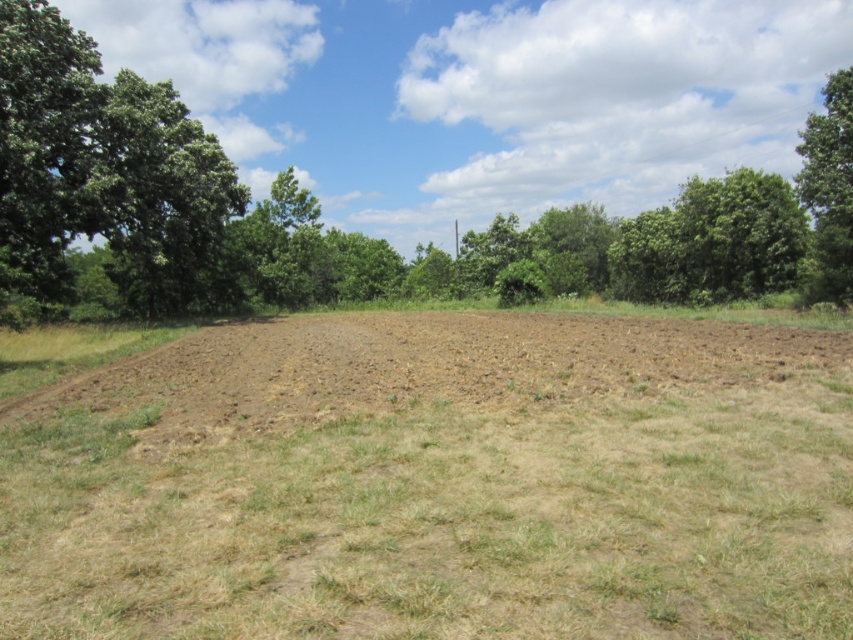
Question: Where is brown soil at center located in relation to green leafy tree at upper right in the image?

Choices:
 (A) below
 (B) above

Answer: (A)

Question: Which of the following is the closest to the observer?

Choices:
 (A) (144, 80)
 (B) (144, 280)

Answer: (B)

Question: From the image, what is the correct spatial relationship of green leafy tree at center in relation to green leafy tree at upper right?

Choices:
 (A) left
 (B) right

Answer: (A)

Question: Which object is positioned closest to the brown soil at center?

Choices:
 (A) green leafy tree at upper right
 (B) green leafy tree at center
 (C) green leafy tree at left

Answer: (C)

Question: Where is brown soil at center located in relation to green leafy tree at left in the image?

Choices:
 (A) left
 (B) right

Answer: (B)

Question: Which is farther from the green leafy tree at left?

Choices:
 (A) brown soil at center
 (B) green leafy tree at center

Answer: (B)